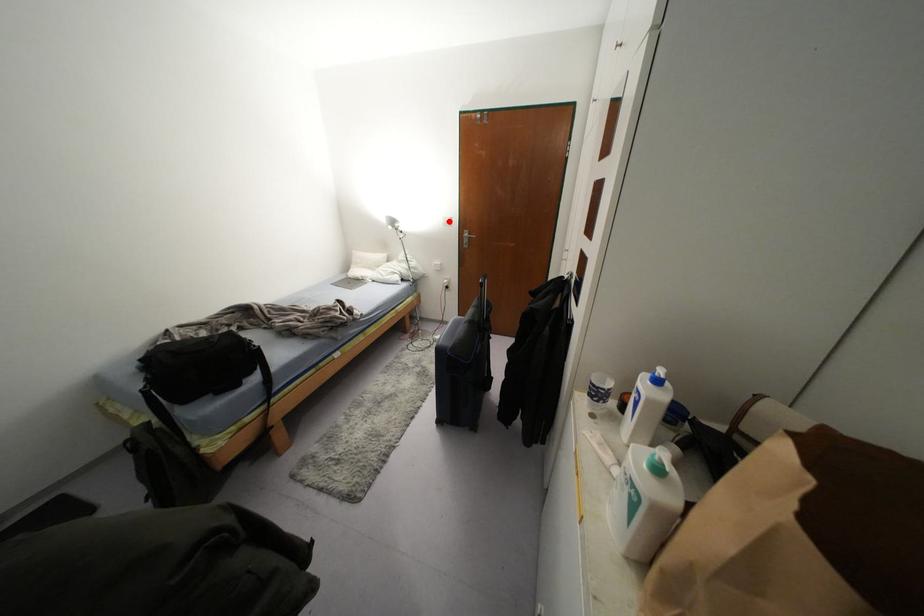
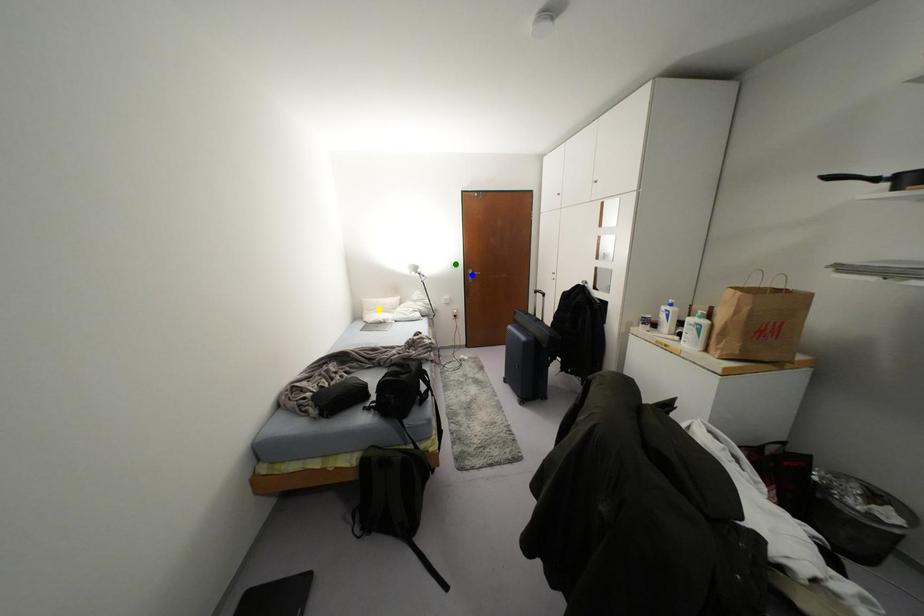
Question: I am providing you with two images of the same scene from different viewpoints. A red point is marked on the first image. You are given multiple points on the second image. Which mark in image 2 goes with the point in image 1?

Choices:
 (A) yellow point
 (B) blue point
 (C) green point

Answer: (C)